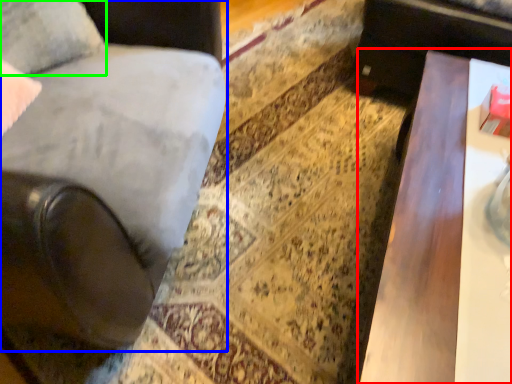
Question: Which is farther away from table (highlighted by a red box)? chair (highlighted by a blue box) or pillow (highlighted by a green box)?

Choices:
 (A) chair
 (B) pillow

Answer: (B)